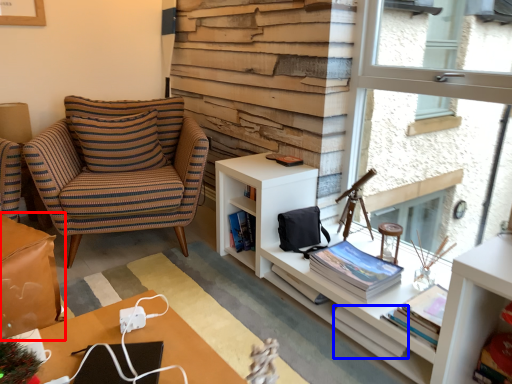
Question: Which object appears closest to the camera in this image, table (highlighted by a red box) or book (highlighted by a blue box)?

Choices:
 (A) table
 (B) book

Answer: (A)